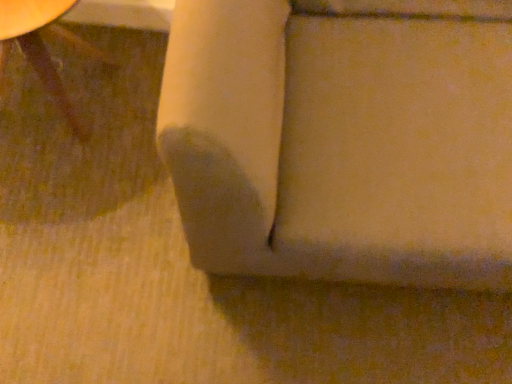
You are a GUI agent. You are given a task and a screenshot of the screen. Output one action in this format:
    pyautogui.click(x=<x>, y=<y>)
    Task: Click on the vacant space in front of matte brown wood table at lower left, placed as the second furniture when sorted from right to left
    The image size is (512, 384).
    Given the screenshot: What is the action you would take?
    pyautogui.click(x=65, y=213)